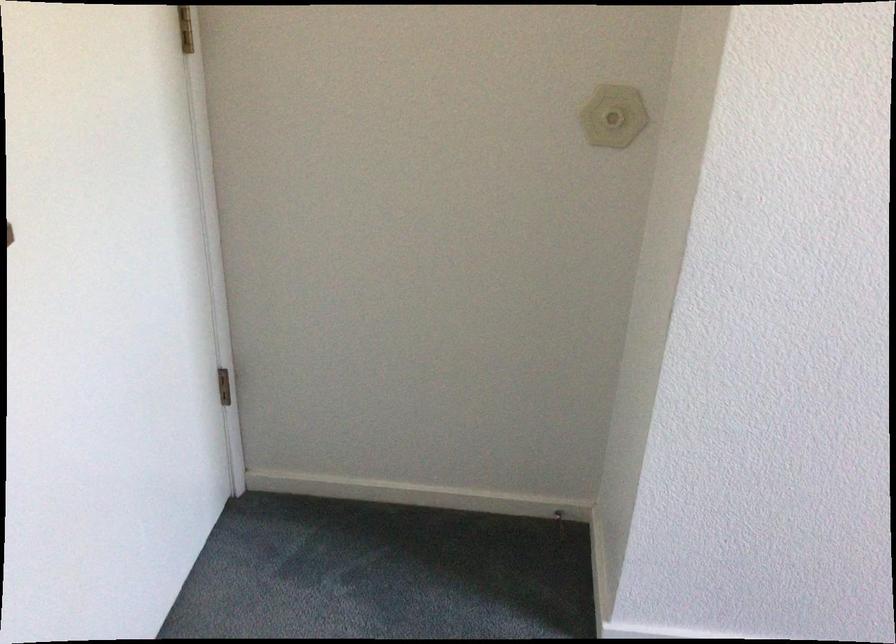
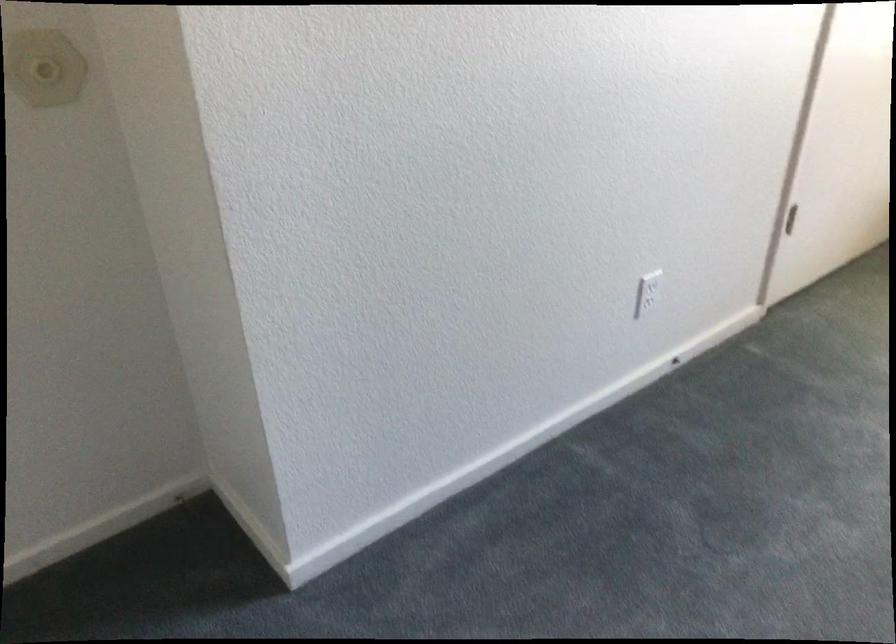
Question: How did the camera likely rotate?

Choices:
 (A) Left
 (B) Right
 (C) Up
 (D) Down

Answer: (B)